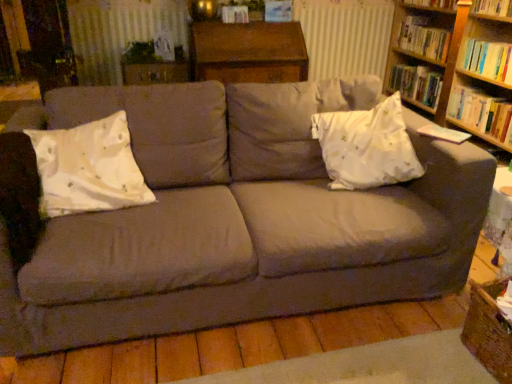
Question: Is hardcover book at right, acting as the 5th book starting from the top, shorter than white satin pillow at right, the 1th throw pillow in the right-to-left sequence?

Choices:
 (A) yes
 (B) no

Answer: (A)

Question: From a real-world perspective, is hardcover book at right, the first book positioned from the bottom, physically above white satin pillow at right, the 2th throw pillow viewed from the left?

Choices:
 (A) no
 (B) yes

Answer: (A)

Question: From the image's perspective, does hardcover book at right, the first book positioned from the bottom, appear lower than white satin pillow at right, the 2th throw pillow viewed from the left?

Choices:
 (A) yes
 (B) no

Answer: (B)

Question: Is hardcover book at right, acting as the 5th book starting from the top, not within white satin pillow at right, the 1th throw pillow in the right-to-left sequence?

Choices:
 (A) yes
 (B) no

Answer: (A)

Question: Is hardcover book at right, acting as the 5th book starting from the top, aimed at white satin pillow at right, the 2th throw pillow viewed from the left?

Choices:
 (A) no
 (B) yes

Answer: (B)

Question: Considering the positions of hardcover book at upper right, positioned as the 4th book in bottom-to-top order, and white satin pillow at left, arranged as the second throw pillow when viewed from the right, in the image, is hardcover book at upper right, positioned as the 4th book in bottom-to-top order, wider or thinner than white satin pillow at left, arranged as the second throw pillow when viewed from the right,?

Choices:
 (A) wide
 (B) thin

Answer: (B)

Question: Is hardcover book at upper right, the 2th book from the top, taller or shorter than white satin pillow at left, which ranks as the 1th throw pillow in left-to-right order?

Choices:
 (A) tall
 (B) short

Answer: (B)

Question: Choose the correct answer: Is hardcover book at upper right, the 2th book from the top, inside white satin pillow at left, which ranks as the 1th throw pillow in left-to-right order, or outside it?

Choices:
 (A) outside
 (B) inside

Answer: (A)

Question: Considering the relative positions of hardcover book at upper right, positioned as the 4th book in bottom-to-top order, and white satin pillow at left, arranged as the second throw pillow when viewed from the right, in the image provided, is hardcover book at upper right, positioned as the 4th book in bottom-to-top order, to the left or to the right of white satin pillow at left, arranged as the second throw pillow when viewed from the right,?

Choices:
 (A) left
 (B) right

Answer: (B)

Question: In terms of size, does white satin pillow at left, arranged as the second throw pillow when viewed from the right, appear bigger or smaller than velvet gray couch at center?

Choices:
 (A) big
 (B) small

Answer: (B)

Question: Is white satin pillow at left, which ranks as the 1th throw pillow in left-to-right order, taller or shorter than velvet gray couch at center?

Choices:
 (A) tall
 (B) short

Answer: (B)

Question: Is white satin pillow at left, which ranks as the 1th throw pillow in left-to-right order, to the left or to the right of velvet gray couch at center in the image?

Choices:
 (A) left
 (B) right

Answer: (A)

Question: From the image's perspective, relative to velvet gray couch at center, is white satin pillow at left, which ranks as the 1th throw pillow in left-to-right order, above or below?

Choices:
 (A) below
 (B) above

Answer: (B)

Question: From the image's perspective, is white satin pillow at right, the 1th throw pillow in the right-to-left sequence, positioned above or below hardcover book at right, acting as the 5th book starting from the top?

Choices:
 (A) below
 (B) above

Answer: (A)

Question: Is white satin pillow at right, the 2th throw pillow viewed from the left, spatially inside hardcover book at right, the first book positioned from the bottom, or outside of it?

Choices:
 (A) inside
 (B) outside

Answer: (B)